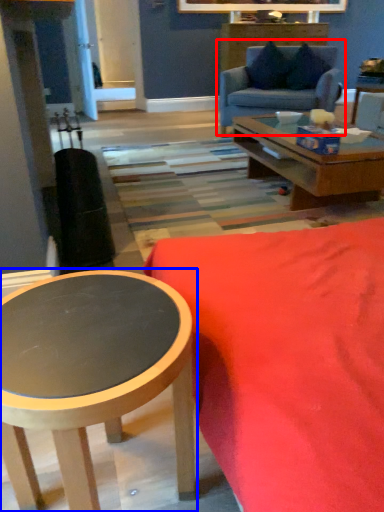
Question: Among these objects, which one is nearest to the camera, studio couch (highlighted by a red box) or coffee table (highlighted by a blue box)?

Choices:
 (A) studio couch
 (B) coffee table

Answer: (B)